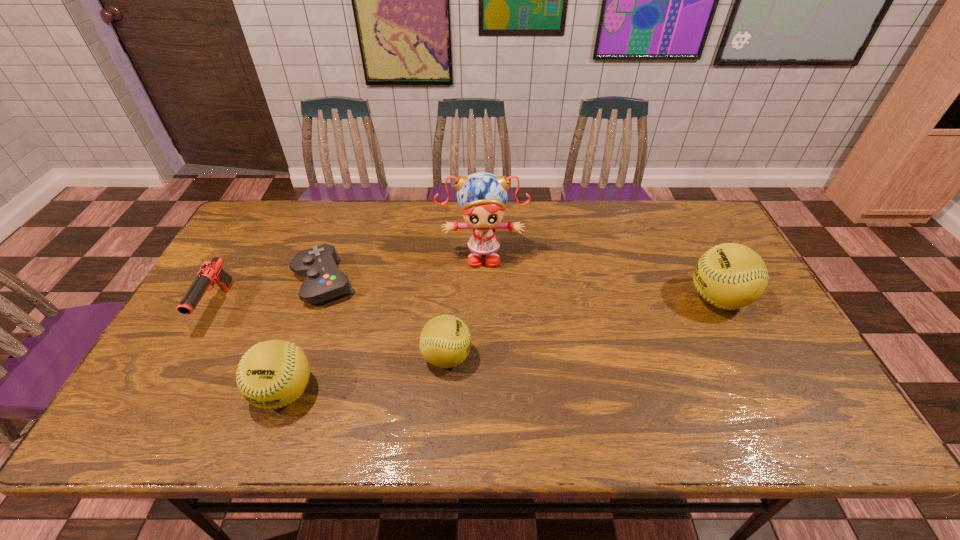
If equal spacing is the goal by inserting an additional softball among them, please point out a vacant space for this new softball. Please provide its 2D coordinates. Your answer should be formatted as a tuple, i.e. [(x, y)], where the tuple contains the x and y coordinates of a point satisfying the conditions above.

[(590, 326)]